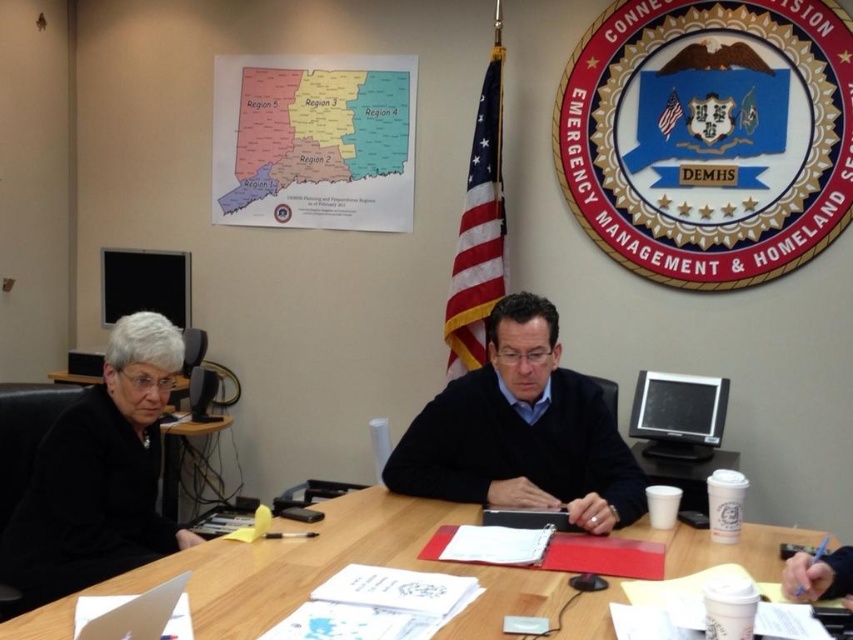
Question: Which point is closer to the camera?

Choices:
 (A) (61, 486)
 (B) (180, 445)
 (C) (666, 552)
 (D) (461, 451)

Answer: (C)

Question: Is wooden table at center in front of black matte jacket at left?

Choices:
 (A) yes
 (B) no

Answer: (A)

Question: Does black sweater at center have a greater width compared to black matte jacket at left?

Choices:
 (A) yes
 (B) no

Answer: (A)

Question: Which of these objects is positioned closest to the black sweater at center?

Choices:
 (A) black matte jacket at left
 (B) wooden table at center

Answer: (B)

Question: Is black sweater at center wider than white paper cup at center?

Choices:
 (A) no
 (B) yes

Answer: (B)

Question: Which object is closer to the camera taking this photo?

Choices:
 (A) black matte jacket at left
 (B) wooden table at center
 (C) black sweater at center
 (D) white paper cup at center

Answer: (B)